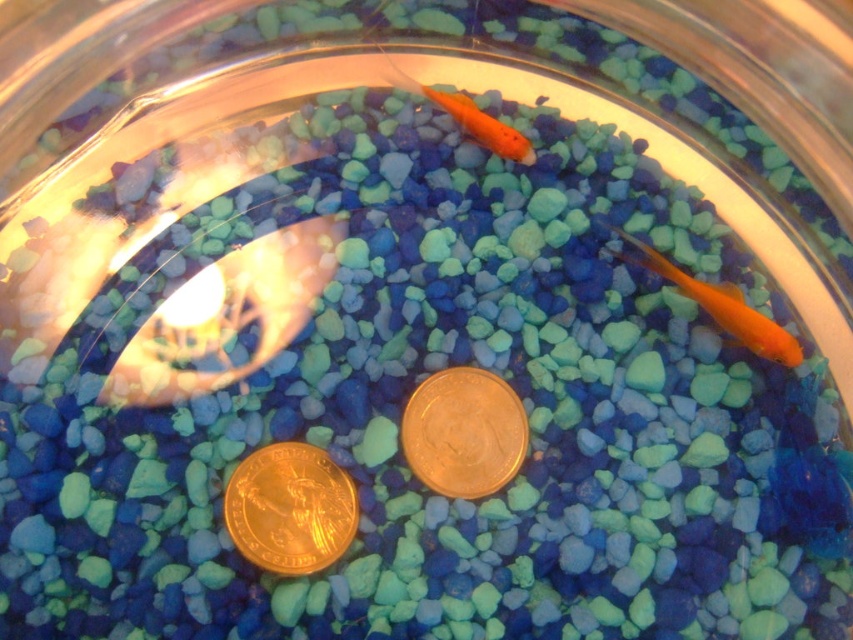
Question: Estimate the real-world distances between objects in this image. Which object is closer to the shiny orange fish at right?

Choices:
 (A) matte orange goldfish at upper center
 (B) gold metallic coin at center
 (C) shiny orange fish at upper center
 (D) gold plated coin at center

Answer: (C)

Question: Is gold metallic coin at center behind shiny orange fish at right?

Choices:
 (A) no
 (B) yes

Answer: (A)

Question: Is shiny orange fish at right closer to the viewer compared to matte orange goldfish at upper center?

Choices:
 (A) no
 (B) yes

Answer: (B)

Question: Which is nearer to the gold metallic coin at center?

Choices:
 (A) shiny orange fish at upper center
 (B) matte orange goldfish at upper center
 (C) gold plated coin at center

Answer: (C)

Question: Based on their relative distances, which object is farther from the shiny orange fish at right?

Choices:
 (A) shiny orange fish at upper center
 (B) matte orange goldfish at upper center
 (C) gold metallic coin at center

Answer: (C)

Question: Is gold metallic coin at center behind matte orange goldfish at upper center?

Choices:
 (A) yes
 (B) no

Answer: (B)